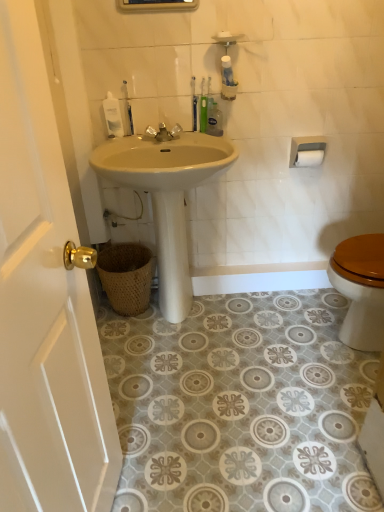
Question: Is white matte toilet paper at upper right taller or shorter than white plastic soap dispenser at upper left, the third toiletry positioned from the right?

Choices:
 (A) short
 (B) tall

Answer: (A)

Question: Which is correct: white matte toilet paper at upper right is inside white plastic soap dispenser at upper left, the third toiletry positioned from the right, or outside of it?

Choices:
 (A) inside
 (B) outside

Answer: (B)

Question: Which of these objects is positioned closest to the white plastic toilet paper holder at upper right?

Choices:
 (A) matte white medicine cabinet at upper center
 (B) white matte toilet paper at upper right
 (C) white matte soap at upper center
 (D) white plastic soap dispenser at upper left, the third toiletry positioned from the right
 (E) metallic faucet at center

Answer: (B)

Question: Which object is positioned farthest from the white plastic toilet paper holder at upper right?

Choices:
 (A) matte white medicine cabinet at upper center
 (B) white glossy sink at center
 (C) woven brown basket at lower left
 (D) white matte soap at upper center
 (E) white plastic soap dispenser at upper left, the third toiletry positioned from the right

Answer: (C)